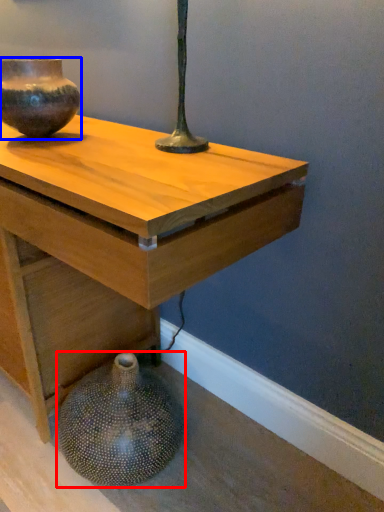
Question: Which object is further to the camera taking this photo, vase (highlighted by a red box) or vase (highlighted by a blue box)?

Choices:
 (A) vase
 (B) vase

Answer: (B)